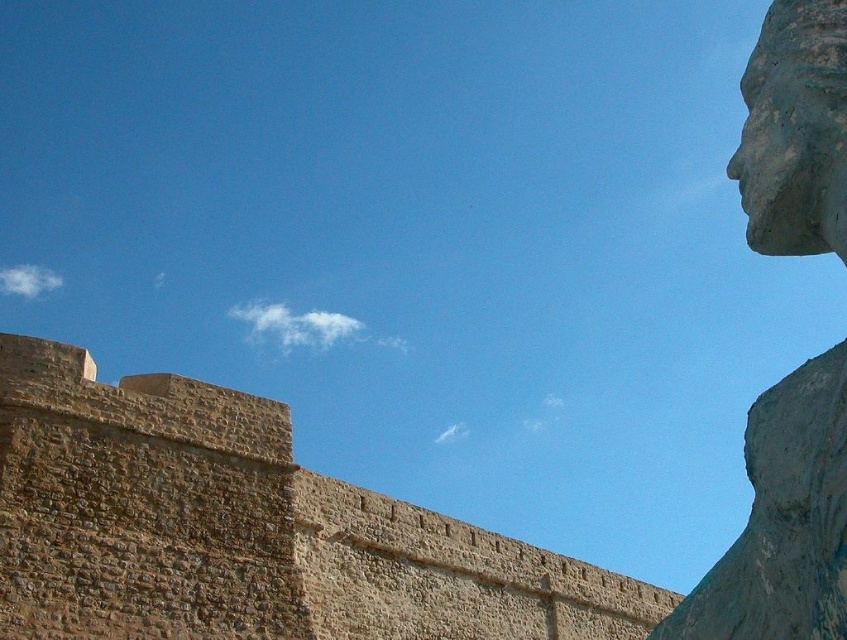
You are an architect analyzing the spatial layout of this historical site. You need to determine the exact coordinates of the brown stone wall at center for your blueprint. What are its coordinates?

The brown stone wall at center is located at coordinates point (x=244, y=529).

You are an art student analyzing the image. You need to determine which object occupies a larger area in the scene. Which one is bigger between the brown stone wall at center and the rustic stone head at upper right?

The rustic stone head at upper right is larger than the brown stone wall at center according to the description.

You are an archaeologist standing at the base of the brown stone wall at center. You want to reach the rustic stone head at upper right to examine its carvings. Given that the distance between them is 96.44 feet, how many steps would you need to take if each step covers about 2.5 feet?

The distance between the brown stone wall at center and the rustic stone head at upper right is 96.44 feet. Since each step covers 2.5 feet, you would need approximately 39 steps to reach the rustic stone head at upper right.